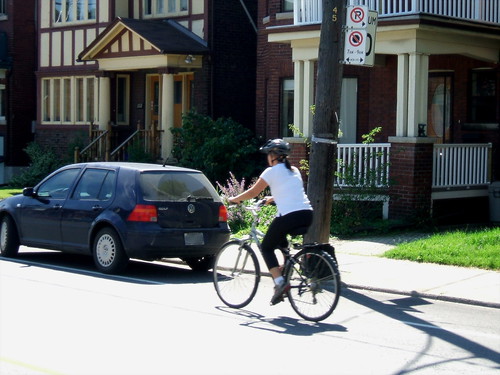
This screenshot has width=500, height=375. I want to click on square pillars, so 299,88, 307,94, 401,94, 415,98, 424,98.